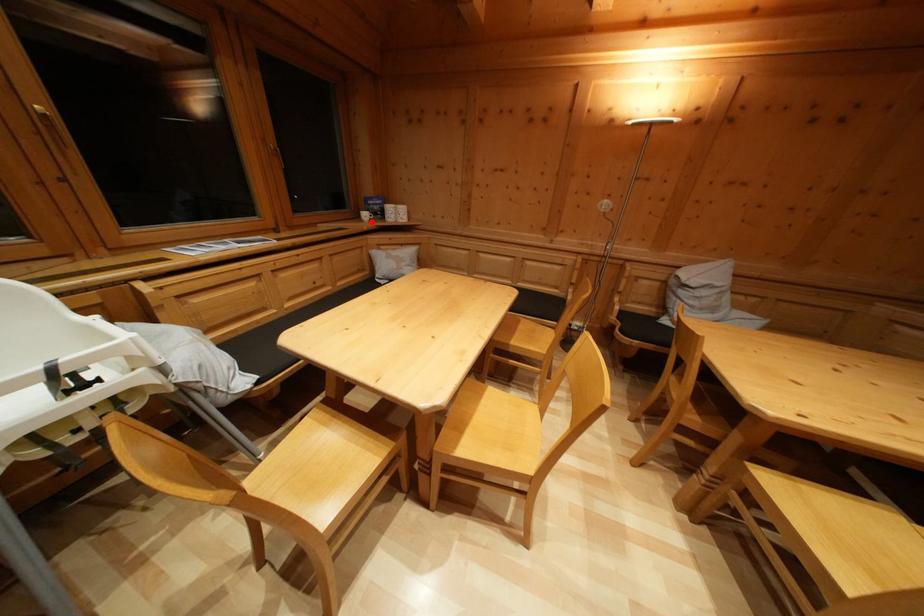
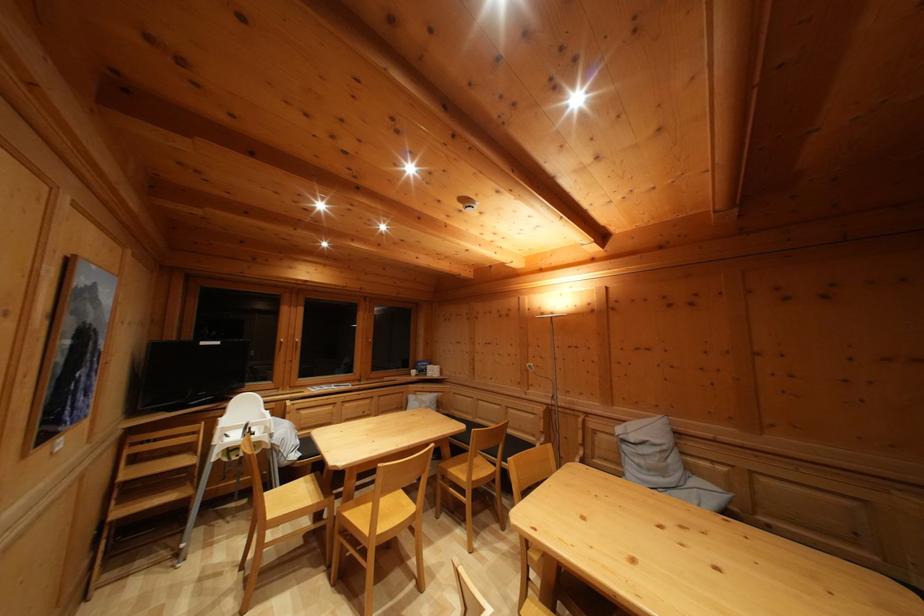
Find the pixel in the second image that matches the highlighted location in the first image.

(419, 379)